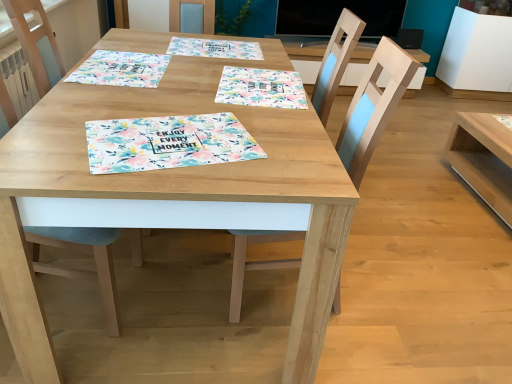
Question: From the image's perspective, would you say light wood table at right, marked as the second table in a left-to-right arrangement, is positioned over floral paper placemat at center, the third tablecloth when ordered from left to right?

Choices:
 (A) yes
 (B) no

Answer: (B)

Question: From a real-world perspective, is light wood table at right, marked as the second table in a left-to-right arrangement, physically below floral paper placemat at center, marked as the first tablecloth in a right-to-left arrangement?

Choices:
 (A) no
 (B) yes

Answer: (B)

Question: From the image's perspective, is light wood table at right, marked as the second table in a left-to-right arrangement, under floral paper placemat at center, marked as the first tablecloth in a right-to-left arrangement?

Choices:
 (A) yes
 (B) no

Answer: (A)

Question: Does light wood table at right, placed as the first table when sorted from right to left, appear on the right side of floral paper placemat at center, the third tablecloth when ordered from left to right?

Choices:
 (A) yes
 (B) no

Answer: (A)

Question: Is light wood table at right, placed as the first table when sorted from right to left, oriented away from floral paper placemat at center, marked as the first tablecloth in a right-to-left arrangement?

Choices:
 (A) yes
 (B) no

Answer: (B)

Question: In terms of height, does floral paper placemat at upper center, the second tablecloth in the left-to-right sequence, look taller or shorter compared to floral paper placemat at center?

Choices:
 (A) short
 (B) tall

Answer: (B)

Question: Is point (207, 54) closer or farther from the camera than point (208, 120)?

Choices:
 (A) farther
 (B) closer

Answer: (A)

Question: From a real-world perspective, is floral paper placemat at upper center, the second tablecloth in the left-to-right sequence, physically located above or below floral paper placemat at center?

Choices:
 (A) above
 (B) below

Answer: (A)

Question: In terms of width, does floral paper placemat at upper center, marked as the second tablecloth in a right-to-left arrangement, look wider or thinner when compared to floral paper placemat at center?

Choices:
 (A) wide
 (B) thin

Answer: (A)

Question: Looking at the image, does wooden chair at center, the first chair when ordered from right to left, seem bigger or smaller compared to light wood table at right, placed as the first table when sorted from right to left?

Choices:
 (A) small
 (B) big

Answer: (B)

Question: Is wooden chair at center, the second chair in the left-to-right sequence, inside or outside of light wood table at right, placed as the first table when sorted from right to left?

Choices:
 (A) inside
 (B) outside

Answer: (B)

Question: Does point (237, 301) appear closer or farther from the camera than point (448, 150)?

Choices:
 (A) closer
 (B) farther

Answer: (A)

Question: Considering the positions of wooden chair at center, the first chair when ordered from right to left, and light wood table at right, placed as the first table when sorted from right to left, in the image, is wooden chair at center, the first chair when ordered from right to left, wider or thinner than light wood table at right, placed as the first table when sorted from right to left,?

Choices:
 (A) wide
 (B) thin

Answer: (B)

Question: From the image's perspective, is wooden table at center, which is the 2th table in right-to-left order, positioned above or below floral paper placemat at center?

Choices:
 (A) below
 (B) above

Answer: (A)

Question: Visually, is wooden table at center, which is the 2th table in right-to-left order, positioned to the left or to the right of floral paper placemat at center?

Choices:
 (A) left
 (B) right

Answer: (A)